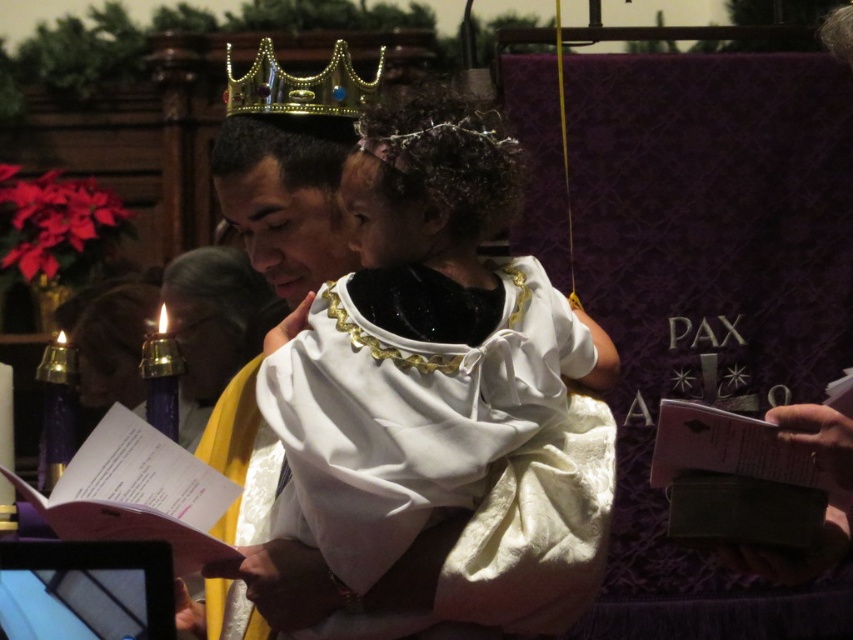
What is the position of the point with coordinates (418, 340) in the image?

The point with coordinates (418, 340) is located on the white satin dress at center.

You are a photographer setting up for a ceremony. You need to adjust the lighting so that both the white satin dress at center and the gold jeweled crown at upper center are well illuminated. Which object requires a higher light intensity due to its position and size?

The white satin dress at center requires higher light intensity because it has a greater height compared to the gold jeweled crown at upper center, so it needs more light to ensure proper illumination.

You are a photographer at the event and want to capture a closeup of the gold jeweled crown at upper center without the white satin dress at center blocking it. What should you do?

Move the camera position to the side so that the white satin dress at center is no longer in front of the gold jeweled crown at upper center. Alternatively, adjust the angle to ensure the gold jeweled crown at upper center is visible without obstruction from the white satin dress at center.